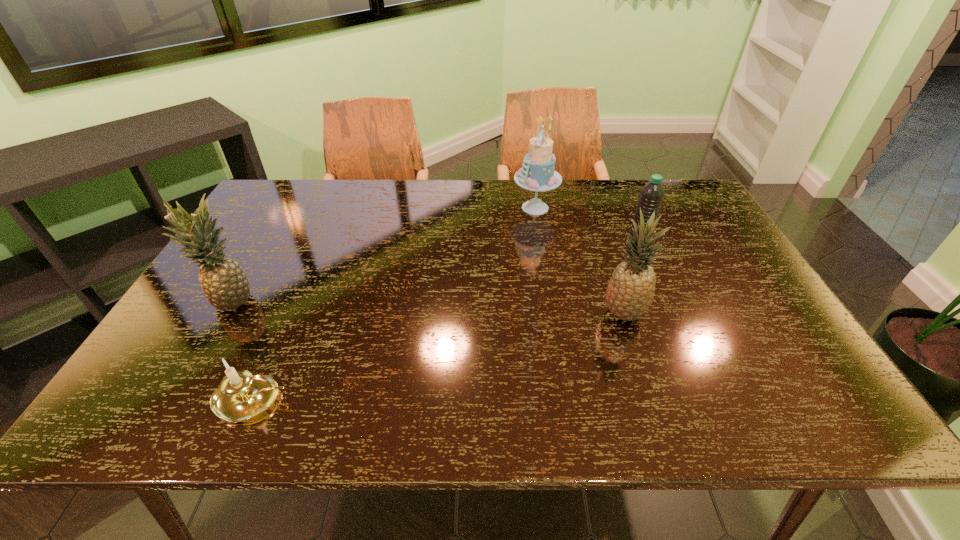
At what (x,y) coordinates should I click in order to perform the action: click on free spot at the left edge of the desktop. Please return your answer as a coordinate pair (x, y). The height and width of the screenshot is (540, 960). Looking at the image, I should click on (171, 331).

Locate an element on the screen. free space at the far left corner of the desktop is located at coordinates (261, 218).

You are a GUI agent. You are given a task and a screenshot of the screen. Output one action in this format:
    pyautogui.click(x=<x>, y=<y>)
    Task: Click on the free location at the near left corner of the desktop
    The height and width of the screenshot is (540, 960).
    Given the screenshot: What is the action you would take?
    pyautogui.click(x=169, y=390)

What are the coordinates of `free region at the far right corner of the desktop` in the screenshot? It's located at (679, 191).

This screenshot has width=960, height=540. Find the location of `empty space that is in between the cake and the water bottle`. empty space that is in between the cake and the water bottle is located at coordinates (587, 224).

Image resolution: width=960 pixels, height=540 pixels. I want to click on empty space that is in between the fourth tallest object and the third object from left to right, so pos(587,224).

What are the coordinates of `free space between the leftmost object and the nearest object` in the screenshot? It's located at (243, 349).

Find the location of `empty location between the right pineapple and the third object from left to right`. empty location between the right pineapple and the third object from left to right is located at coordinates pos(579,261).

Image resolution: width=960 pixels, height=540 pixels. In order to click on vacant point located between the fourth nearest object and the candle holder in this screenshot , I will do (x=445, y=320).

Locate an element on the screen. empty location between the candle holder and the third object from left to right is located at coordinates tap(394, 303).